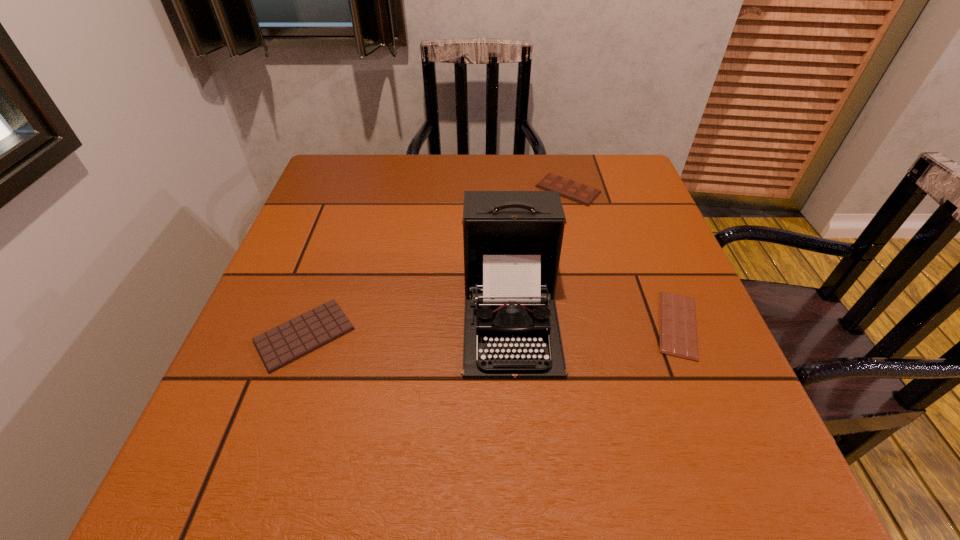
The height and width of the screenshot is (540, 960). I want to click on vacant space situated on the back of the rightmost chocolate bar, so click(629, 203).

Locate an element on the screen. This screenshot has height=540, width=960. object situated at the far edge is located at coordinates (572, 190).

Locate an element on the screen. This screenshot has height=540, width=960. object located at the left edge is located at coordinates (282, 345).

The image size is (960, 540). What are the coordinates of `object present at the far right corner` in the screenshot? It's located at (572, 190).

Locate an element on the screen. free space at the far edge of the desktop is located at coordinates (420, 153).

Image resolution: width=960 pixels, height=540 pixels. In the image, there is a desktop. Find the location of `vacant space at the left edge`. vacant space at the left edge is located at coordinates (238, 356).

At what (x,y) coordinates should I click in order to perform the action: click on vacant space at the right edge of the desktop. Please return your answer as a coordinate pair (x, y). This screenshot has height=540, width=960. Looking at the image, I should click on (629, 272).

Find the location of a particular element. The image size is (960, 540). free region at the far left corner of the desktop is located at coordinates (348, 157).

In the image, there is a desktop. Where is `vacant space at the near left corner`? vacant space at the near left corner is located at coordinates (245, 462).

The width and height of the screenshot is (960, 540). In the image, there is a desktop. Find the location of `vacant region at the far right corner`. vacant region at the far right corner is located at coordinates (611, 174).